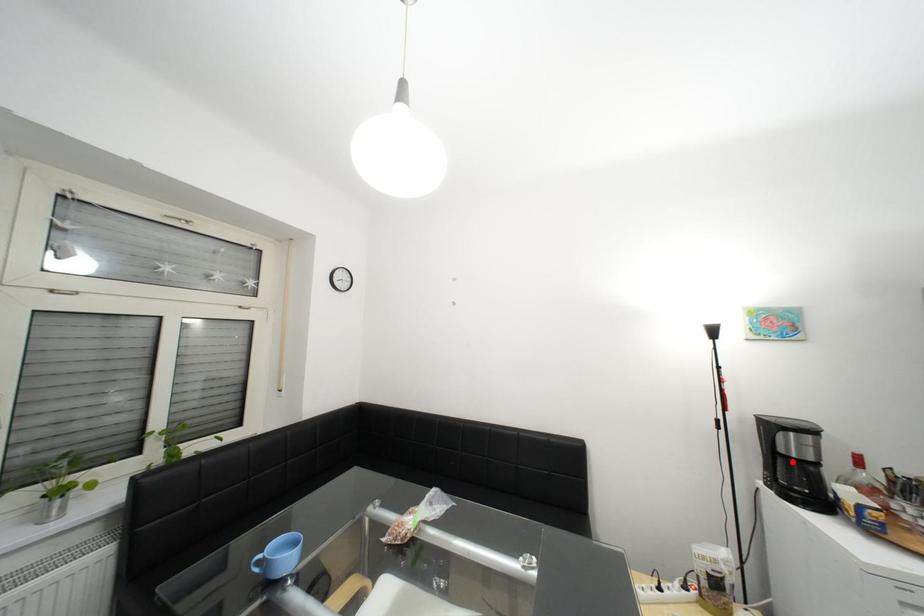
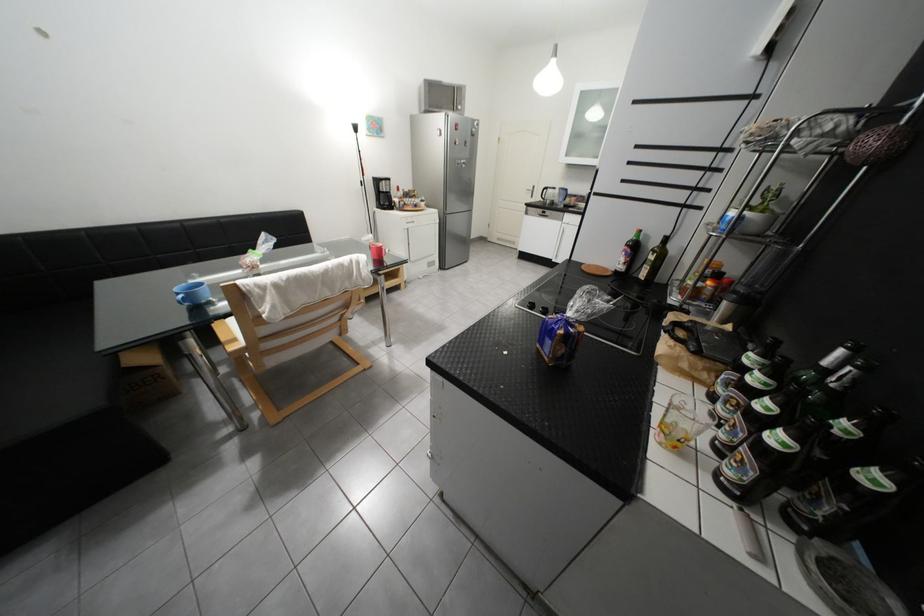
Question: I am providing you with two images of the same scene from different viewpoints. Given a red point in image1, look at the same physical point in image2. Is it:

Choices:
 (A) Closer to the viewpoint
 (B) Farther from the viewpoint

Answer: (A)